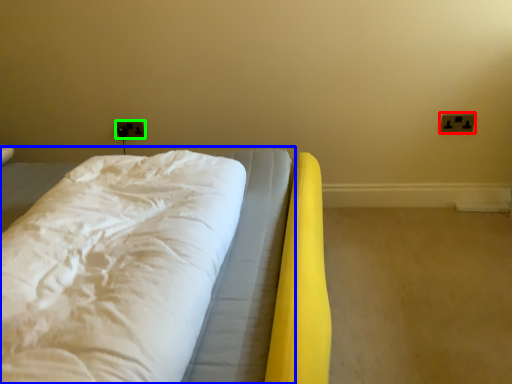
Question: Which is nearer to the electric outlet (highlighted by a red box)? bed (highlighted by a blue box) or electric outlet (highlighted by a green box).

Choices:
 (A) bed
 (B) electric outlet

Answer: (A)